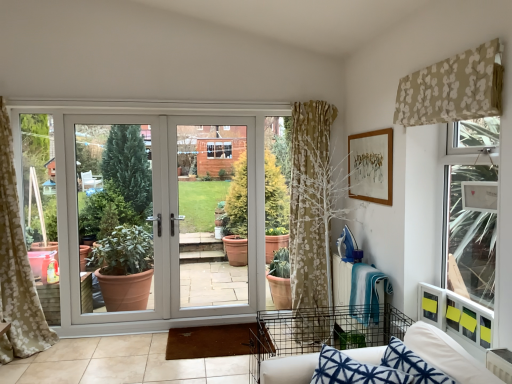
Question: Is blue printed fabric couch at lower right bigger or smaller than beige floral fabric at upper right?

Choices:
 (A) big
 (B) small

Answer: (A)

Question: In terms of width, does blue printed fabric couch at lower right look wider or thinner when compared to beige floral fabric at upper right?

Choices:
 (A) thin
 (B) wide

Answer: (B)

Question: Based on their relative distances, which object is farther from the white glossy door at center?

Choices:
 (A) beige floral fabric at upper right
 (B) white plastic door at center
 (C) blue printed fabric couch at lower right

Answer: (C)

Question: Considering the real-world distances, which object is closest to the white glossy door at center?

Choices:
 (A) blue printed fabric couch at lower right
 (B) beige floral fabric at upper right
 (C) white plastic door at center

Answer: (C)